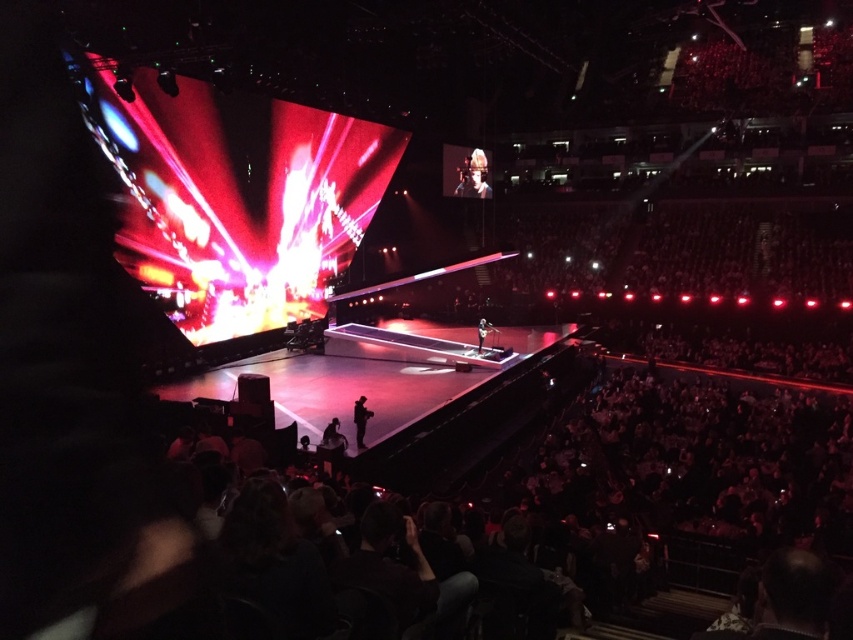
Is dark gray fabric jacket at center smaller than smooth black suit at center?

Yes.

Between dark gray fabric jacket at center and smooth black suit at center, which one appears on the right side from the viewer's perspective?

From the viewer's perspective, smooth black suit at center appears more on the right side.

Describe the element at coordinates (360, 419) in the screenshot. I see `dark gray fabric jacket at center` at that location.

At what (x,y) coordinates should I click in order to perform the action: click on dark gray fabric jacket at center. Please return your answer as a coordinate pair (x, y). Looking at the image, I should click on (360, 419).

Is point (486, 161) behind point (483, 337)?

Yes, it is behind point (483, 337).

Which of these two, smooth skin face at upper center or smooth black suit at center, stands shorter?

With less height is smooth black suit at center.

At what (x,y) coordinates should I click in order to perform the action: click on smooth skin face at upper center. Please return your answer as a coordinate pair (x, y). Image resolution: width=853 pixels, height=640 pixels. Looking at the image, I should click on (474, 177).

Between smooth skin face at upper center and dark gray fabric jacket at center, which one appears on the left side from the viewer's perspective?

From the viewer's perspective, dark gray fabric jacket at center appears more on the left side.

Based on the photo, is the position of smooth skin face at upper center more distant than that of dark gray fabric jacket at center?

Yes, it is.

Locate an element on the screen. The height and width of the screenshot is (640, 853). smooth skin face at upper center is located at coordinates (474, 177).

I want to click on smooth skin face at upper center, so click(474, 177).